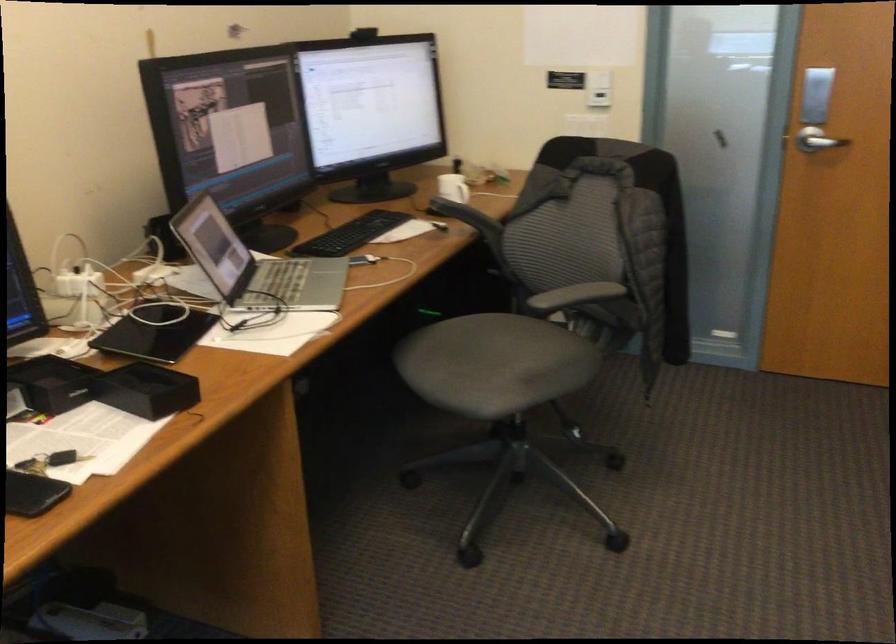
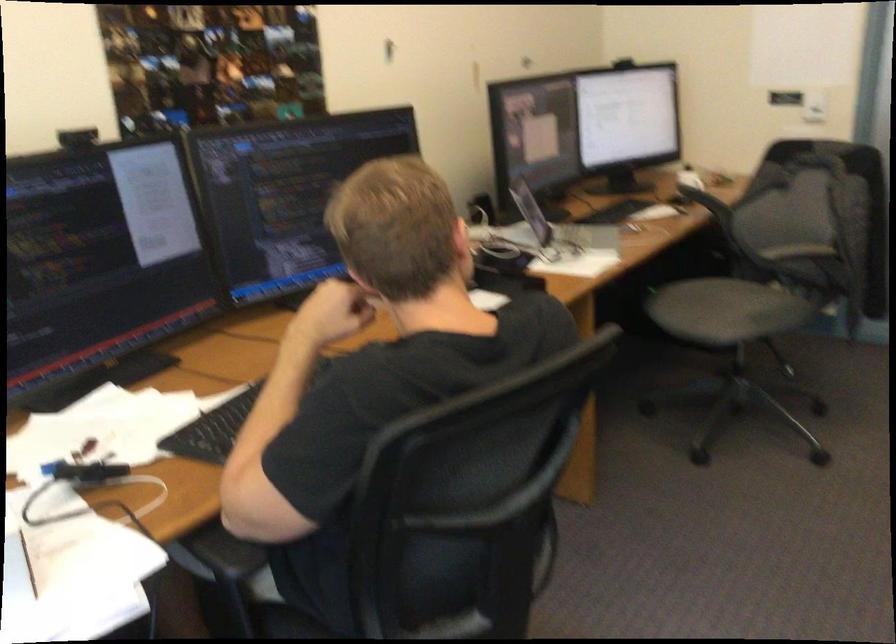
Where in the second image is the point corresponding to the point at 474,375 from the first image?

(709, 308)